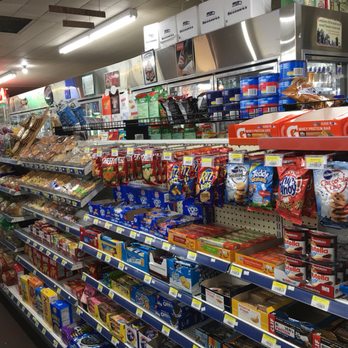
I want to click on ceiling light bulbs, so click(100, 32), click(77, 45), click(4, 76).